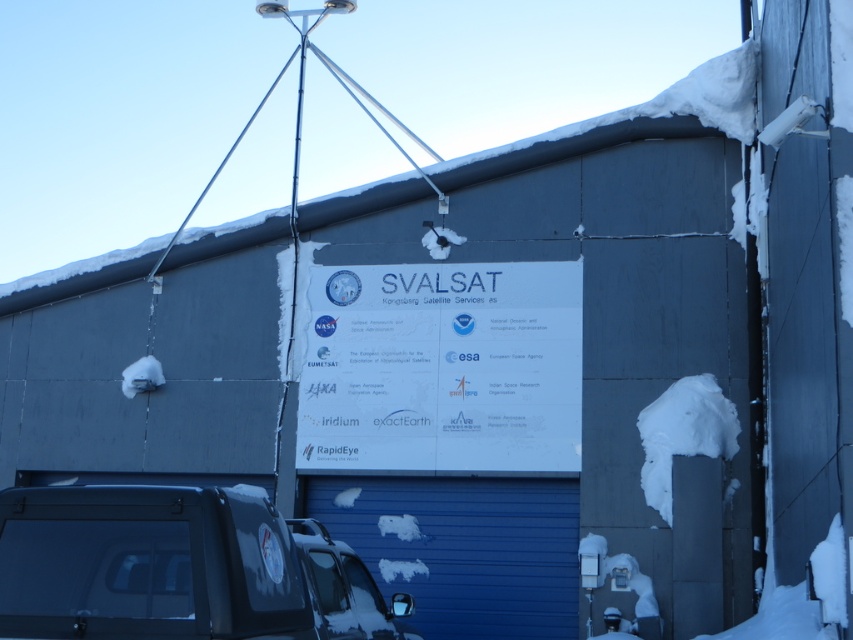
You are standing in front of the building with the SVALSAT sign. There is a point marked at coordinates (442,369). What is located at that point?

The point marked at (442,369) indicates the location of the white paper sign at center.

You are standing in front of the building with the SVALSAT sign. There is a point at coordinates point (463,548). What object is located at this point?

The point (463,548) corresponds to the blue metallic garage door at lower center.